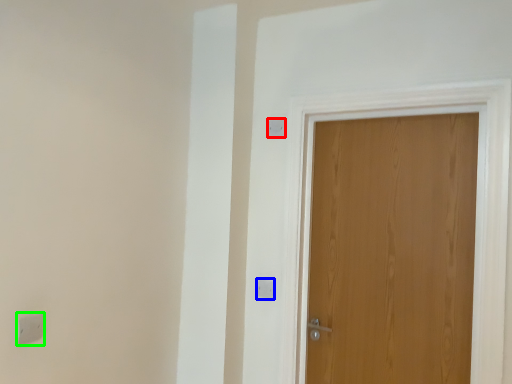
Question: Considering the real-world distances, which object is closest to light switch (highlighted by a red box)? light switch (highlighted by a blue box) or light switch (highlighted by a green box).

Choices:
 (A) light switch
 (B) light switch

Answer: (A)